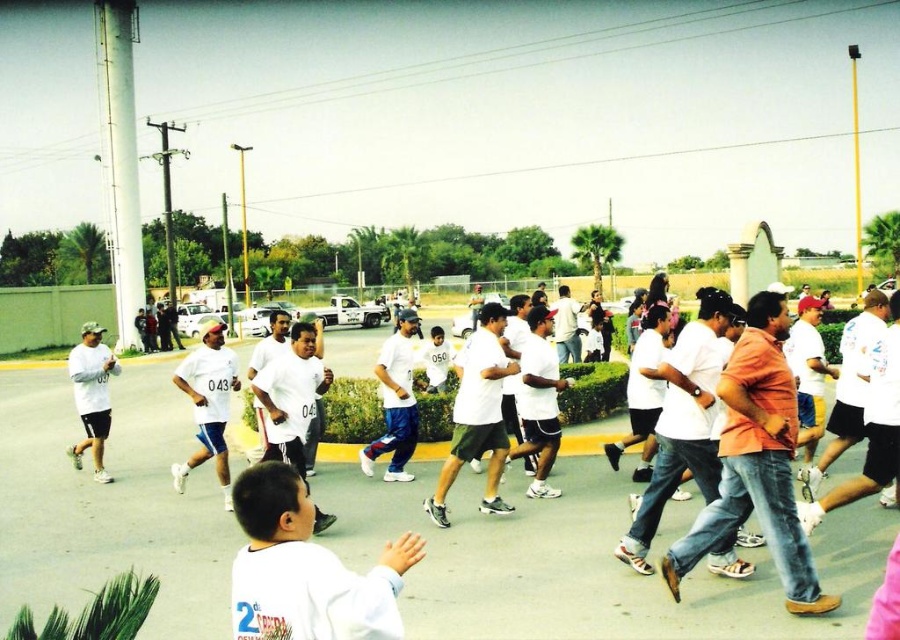
Measure the distance from white matte shirt at lower left to white matte shirt at left.

white matte shirt at lower left and white matte shirt at left are 24.53 feet apart.

Which is below, white matte shirt at lower left or white matte shirt at left?

white matte shirt at left

Which is in front, point (367, 604) or point (101, 326)?

Positioned in front is point (367, 604).

Locate an element on the screen. The width and height of the screenshot is (900, 640). white matte shirt at lower left is located at coordinates (306, 570).